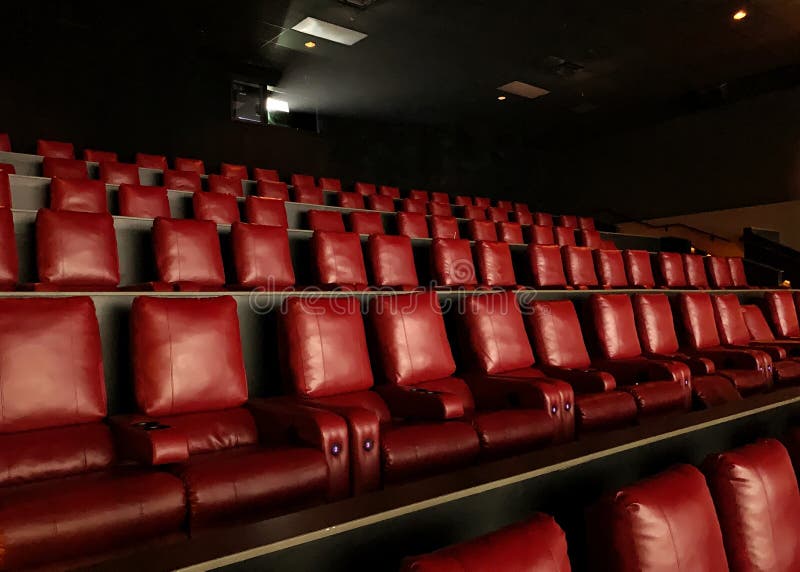
Locate an element on the screen. drink holder is located at coordinates (150, 423), (426, 389), (586, 368), (682, 356), (760, 343).